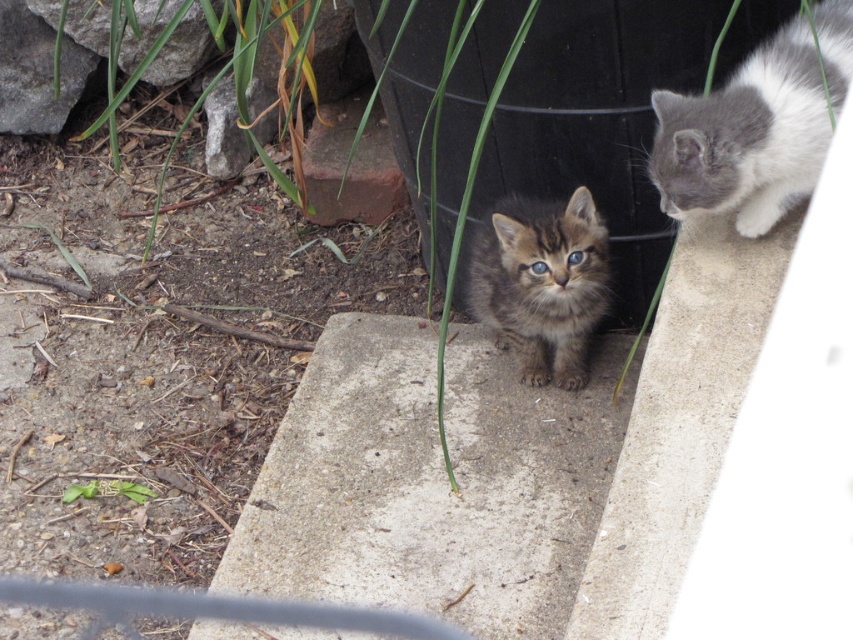
Question: Is gray-white fluffy cat at upper right wider than green leafy plant at lower left?

Choices:
 (A) no
 (B) yes

Answer: (B)

Question: Can you confirm if tabby fur kitten at center is thinner than green leafy plant at center?

Choices:
 (A) yes
 (B) no

Answer: (A)

Question: Which object is closer to the camera taking this photo?

Choices:
 (A) green leafy plant at center
 (B) tabby fur kitten at center

Answer: (A)

Question: Can you confirm if gray-white fluffy cat at upper right is positioned to the right of green leafy plant at lower left?

Choices:
 (A) yes
 (B) no

Answer: (A)

Question: Which object is the closest to the gray-white fluffy cat at upper right?

Choices:
 (A) tabby fur kitten at center
 (B) green leafy plant at center
 (C) green leafy plant at lower left

Answer: (A)

Question: Which of these objects is positioned closest to the green leafy plant at lower left?

Choices:
 (A) tabby fur kitten at center
 (B) gray-white fluffy cat at upper right

Answer: (A)